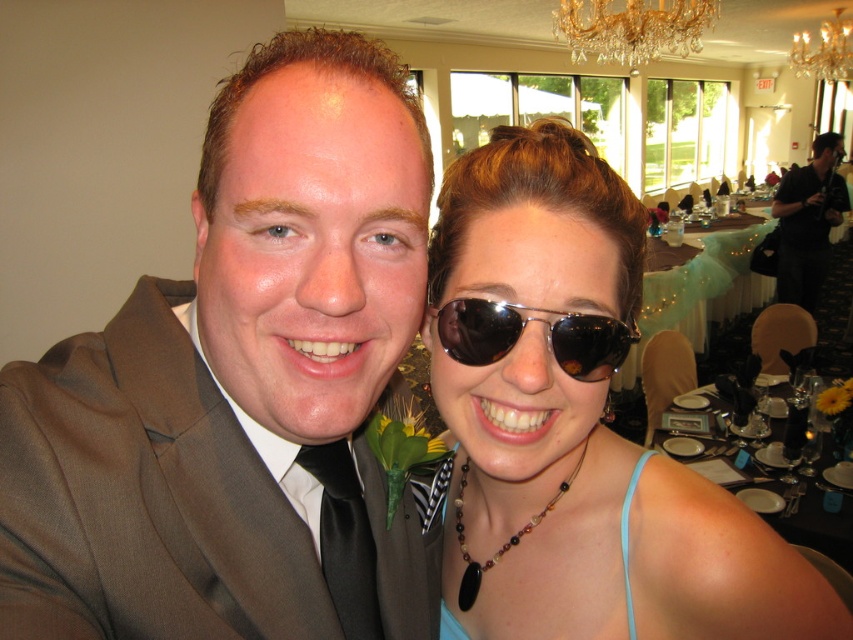
Is gold crystal chandelier at upper center below black leather jacket at upper right?

No.

I want to click on gold crystal chandelier at upper center, so click(633, 28).

Locate an element on the screen. gold crystal chandelier at upper center is located at coordinates (633, 28).

Looking at this image, is matte brown suit at center further to camera compared to light blue fabric dress at center?

No, it is not.

Which is in front, point (225, 204) or point (622, 576)?

Point (225, 204)

What do you see at coordinates (241, 387) in the screenshot? I see `matte brown suit at center` at bounding box center [241, 387].

The height and width of the screenshot is (640, 853). I want to click on matte brown suit at center, so click(241, 387).

Is matte black sunglasses at upper right in front of black satin tie at center?

Yes, it is.

Who is positioned more to the left, matte black sunglasses at upper right or black satin tie at center?

From the viewer's perspective, black satin tie at center appears more on the left side.

Which is behind, point (572, 376) or point (345, 586)?

Positioned behind is point (345, 586).

Where is `matte black sunglasses at upper right`? Image resolution: width=853 pixels, height=640 pixels. matte black sunglasses at upper right is located at coordinates (575, 426).